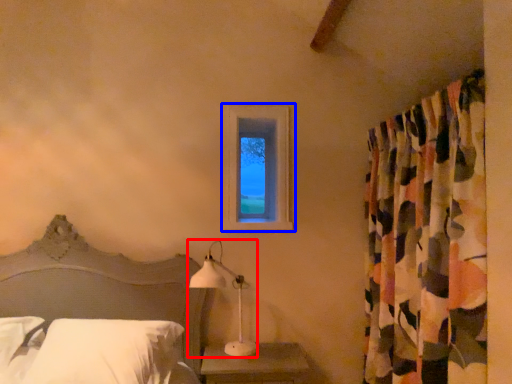
Question: Which object is further to the camera taking this photo, table lamp (highlighted by a red box) or window (highlighted by a blue box)?

Choices:
 (A) table lamp
 (B) window

Answer: (B)